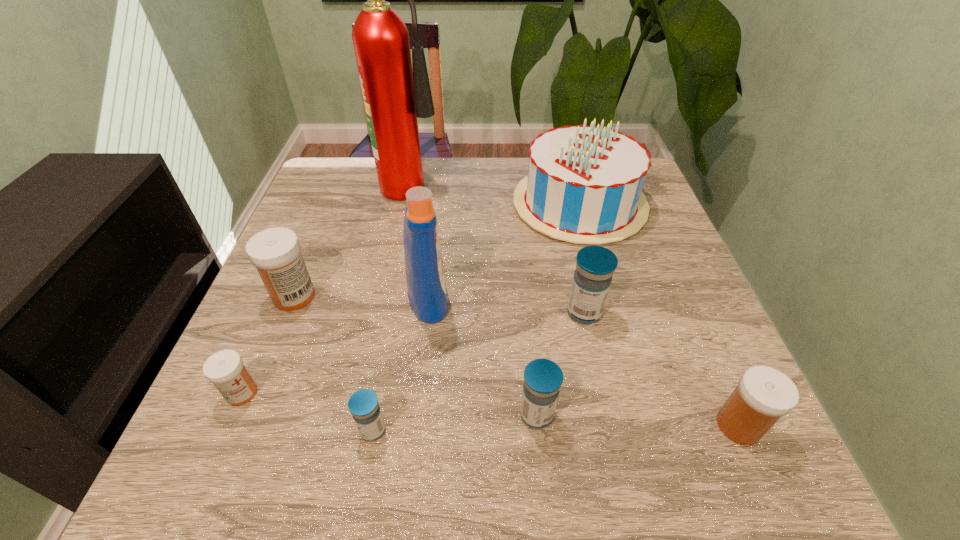
This screenshot has height=540, width=960. Identify the location of vacant space at the far edge of the desktop. (373, 197).

Image resolution: width=960 pixels, height=540 pixels. Identify the location of free region at the near edge of the desktop. (386, 445).

Find the location of a particular element. The height and width of the screenshot is (540, 960). vacant space at the left edge of the desktop is located at coordinates (315, 217).

At what (x,y) coordinates should I click in order to perform the action: click on vacant region at the right edge of the desktop. Please return your answer as a coordinate pair (x, y). This screenshot has height=540, width=960. Looking at the image, I should click on (722, 363).

The height and width of the screenshot is (540, 960). Find the location of `free region at the far left corner of the desktop`. free region at the far left corner of the desktop is located at coordinates (320, 202).

The image size is (960, 540). I want to click on free space at the near right corner, so click(x=734, y=470).

Find the location of a particular element. vacant region between the tallest object and the white birthday cake is located at coordinates (496, 192).

This screenshot has width=960, height=540. Find the location of `unoccupied position between the fourth medicine from right to left and the second biggest blue medicine`. unoccupied position between the fourth medicine from right to left and the second biggest blue medicine is located at coordinates (455, 422).

The height and width of the screenshot is (540, 960). In order to click on vacant point located between the second biggest blue medicine and the red fire extinguisher in this screenshot , I will do `click(474, 298)`.

Where is `empty space that is in between the rightmost medicine and the second biggest blue medicine`? The width and height of the screenshot is (960, 540). empty space that is in between the rightmost medicine and the second biggest blue medicine is located at coordinates (637, 420).